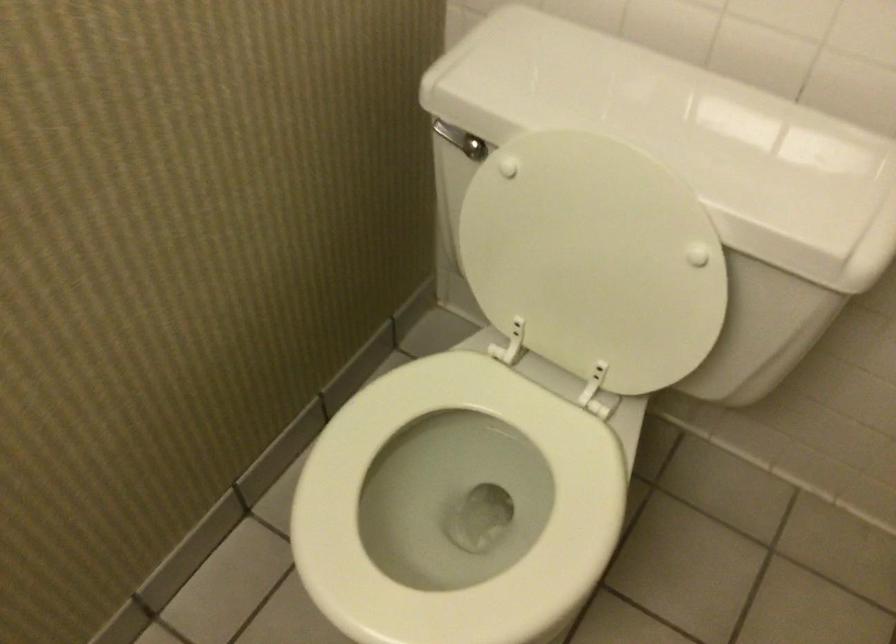
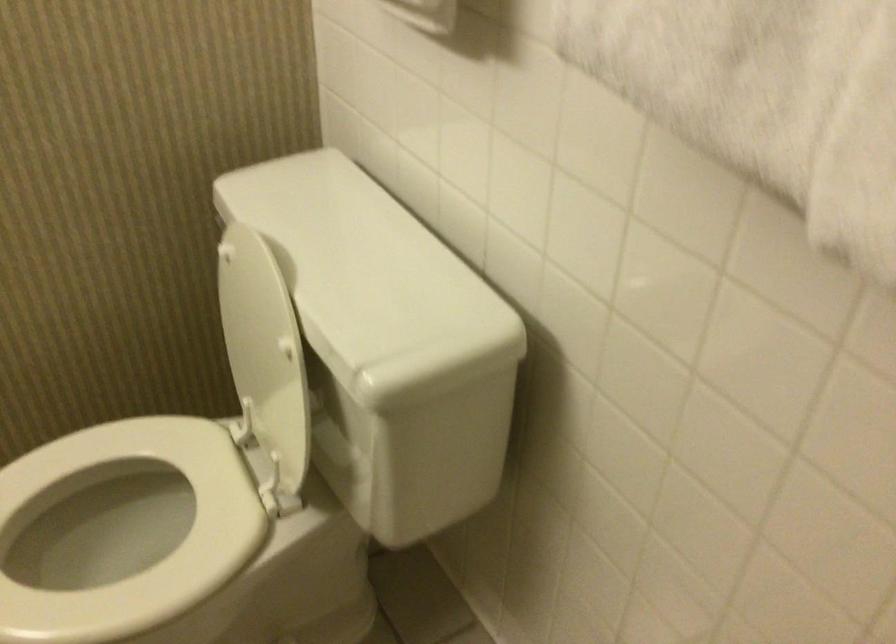
Find the pixel in the second image that matches the point at 380,518 in the first image.

(97, 545)